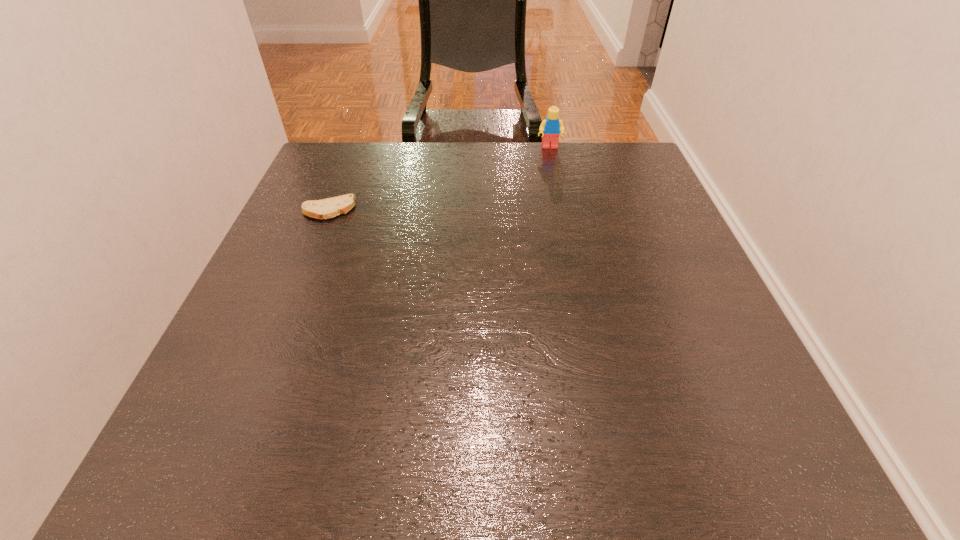
The width and height of the screenshot is (960, 540). I want to click on the taller object, so click(550, 128).

You are a GUI agent. You are given a task and a screenshot of the screen. Output one action in this format:
    pyautogui.click(x=<x>, y=<y>)
    Task: Click on the right object
    
    Given the screenshot: What is the action you would take?
    pyautogui.click(x=550, y=128)

You are a GUI agent. You are given a task and a screenshot of the screen. Output one action in this format:
    pyautogui.click(x=<x>, y=<y>)
    Task: Click on the left object
    The height and width of the screenshot is (540, 960).
    Given the screenshot: What is the action you would take?
    pyautogui.click(x=327, y=208)

The image size is (960, 540). Identify the location of the nearer object. (327, 208).

Find the location of a particular element. vacant space situated 0.180m on the front-facing side of the Lego is located at coordinates (559, 186).

Locate an element on the screen. The image size is (960, 540). free spot located 0.240m on the right of the pita bread is located at coordinates (454, 210).

The height and width of the screenshot is (540, 960). Find the location of `object that is at the far edge`. object that is at the far edge is located at coordinates (550, 128).

Identify the location of object positioned at the left edge. (327, 208).

Where is `blank space at the far edge of the desktop`? This screenshot has width=960, height=540. blank space at the far edge of the desktop is located at coordinates (489, 180).

Identify the location of vacant space at the near edge of the desktop. (345, 434).